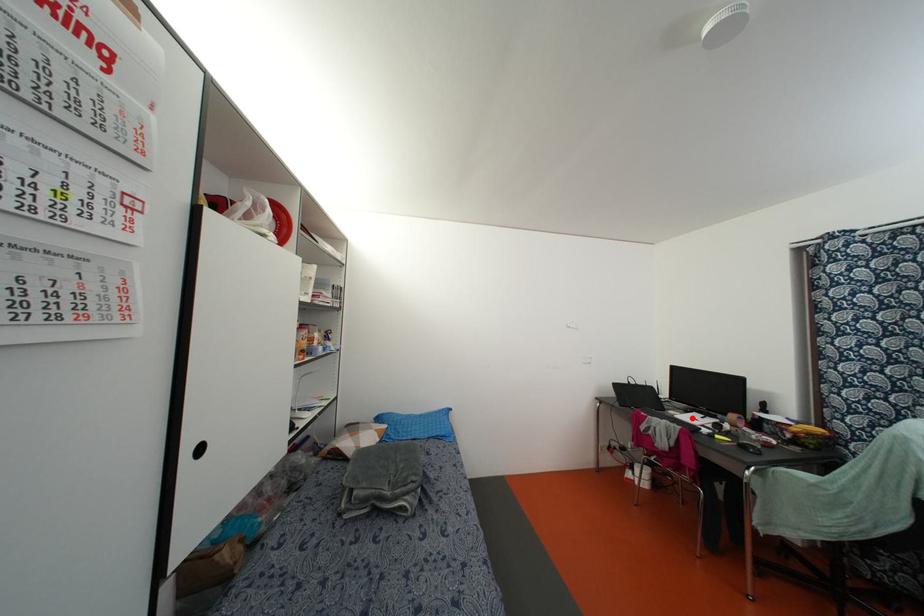
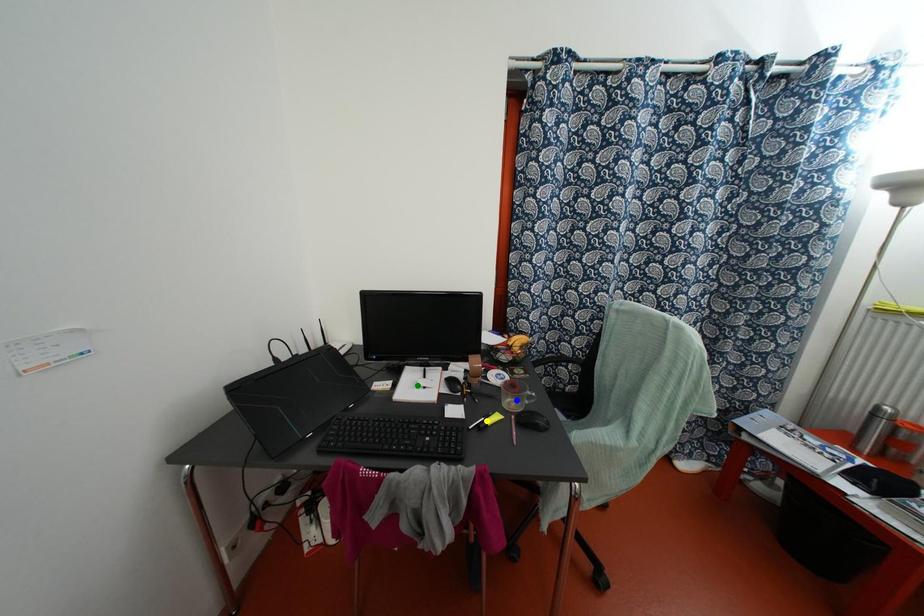
Question: I am providing you with two images of the same scene from different viewpoints. A red point is marked on the first image. You are given multiple points on the second image. Can you choose the point in image 2 that corresponds to the point in image 1?

Choices:
 (A) blue point
 (B) green point
 (C) yellow point

Answer: (B)